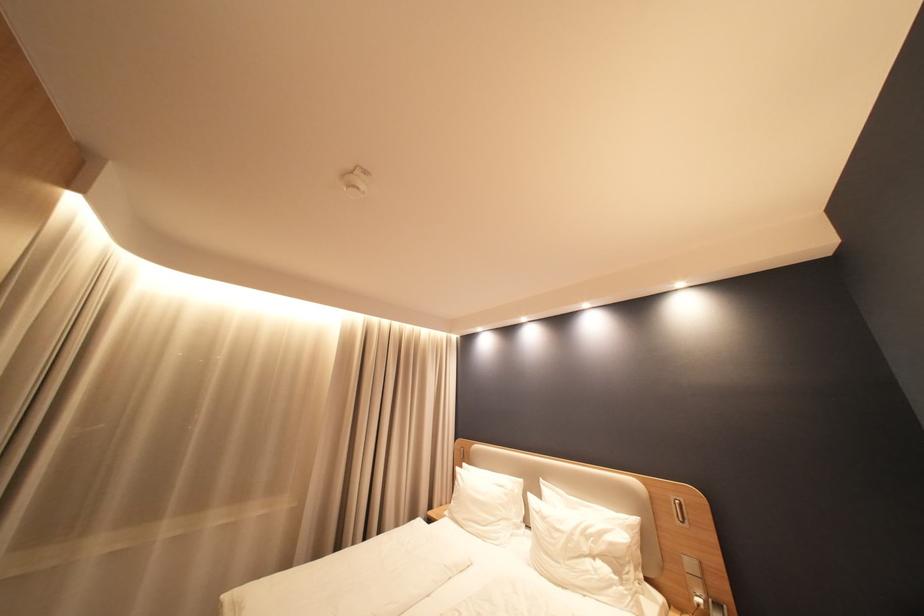
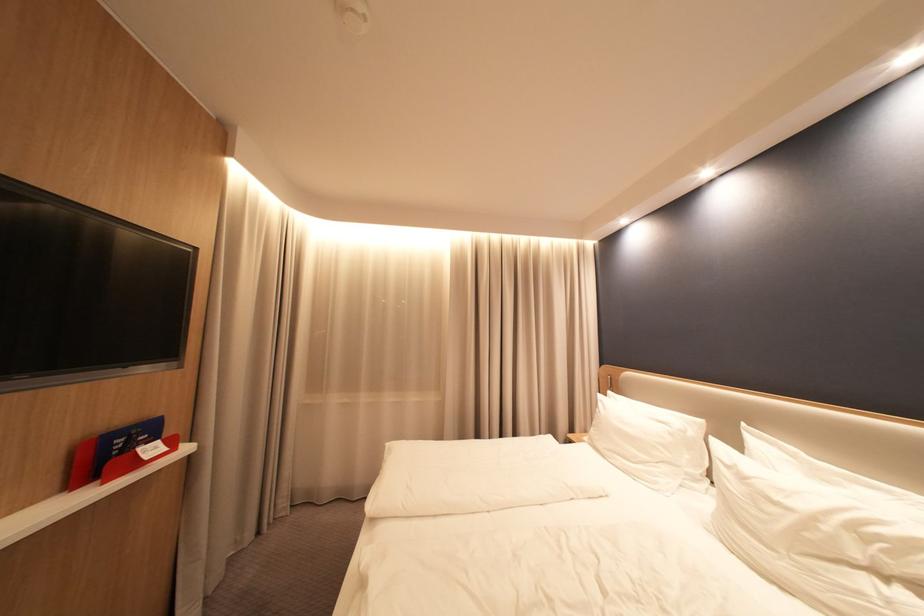
Where in the second image is the point corresponding to [470,468] from the first image?

(615, 397)